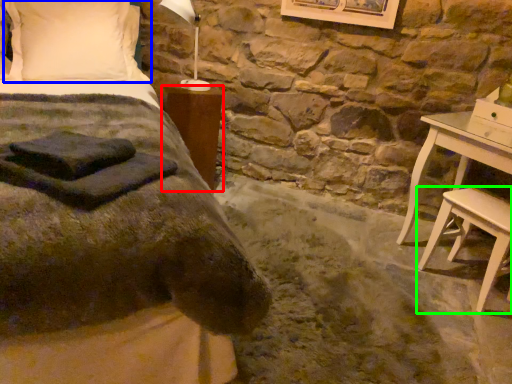
Question: Based on their relative distances, which object is nearer to nightstand (highlighted by a red box)? Choose from pillow (highlighted by a blue box) and stool (highlighted by a green box).

Choices:
 (A) pillow
 (B) stool

Answer: (A)